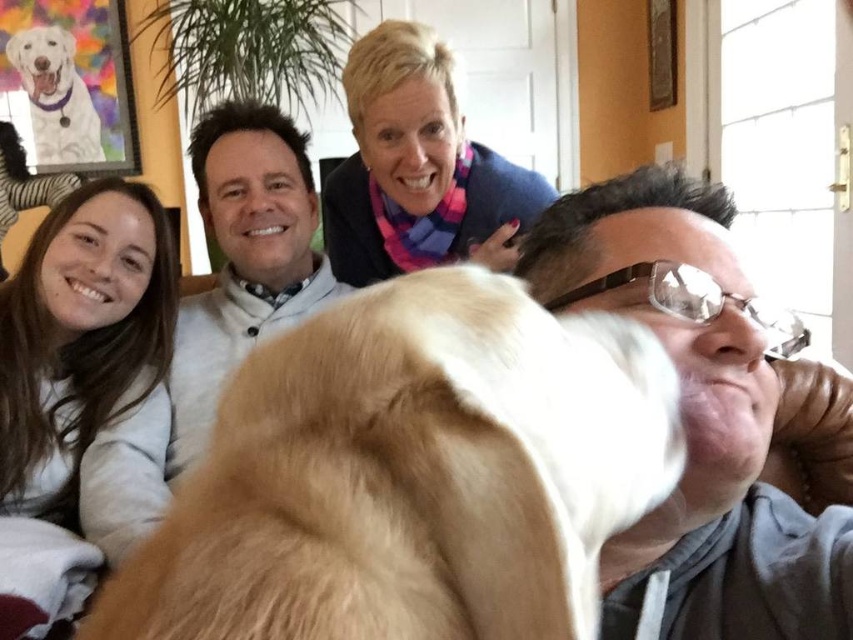
Based on the scene description, where is the golden fur dog at center located in the image?

The golden fur dog at center is located at point 0.742 on the x axis and 0.483 on the y axis.

You are trying to decide which dog to adopt from the shelter. Both the golden fur dog at center and the white fur dog at upper left are available. Based on their body shapes, which one might be more suitable for someone looking for a companion for agility training that requires a leaner build?

The golden fur dog at center is thinner than the white fur dog at upper left, so it might be more suitable for agility training as it has a leaner build.